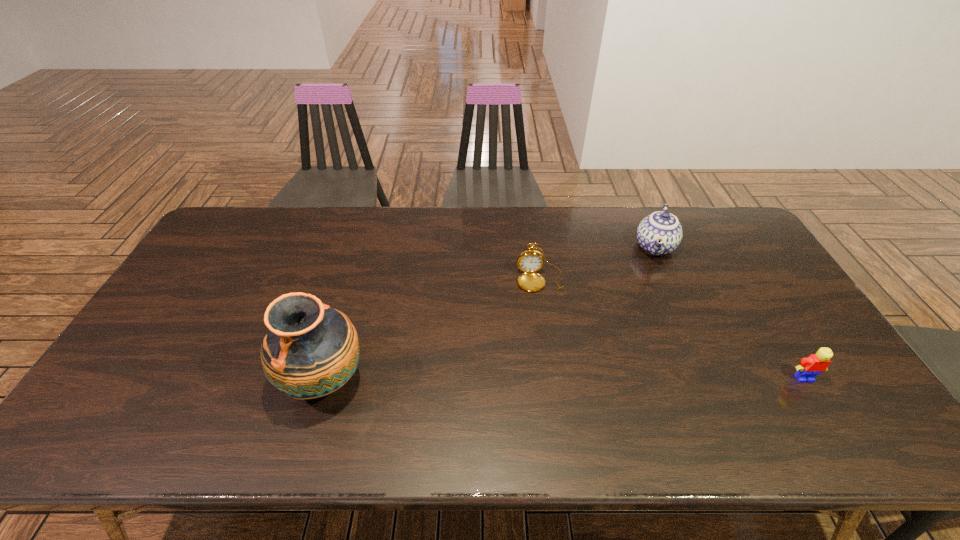
Where is `vacant region at the left edge`? Image resolution: width=960 pixels, height=540 pixels. vacant region at the left edge is located at coordinates (199, 340).

You are a GUI agent. You are given a task and a screenshot of the screen. Output one action in this format:
    pyautogui.click(x=<x>, y=<y>)
    Task: Click on the vacant space at the right edge of the desktop
    
    Given the screenshot: What is the action you would take?
    pyautogui.click(x=776, y=367)

In the image, there is a desktop. Identify the location of vacant space at the far left corner. (249, 242).

Where is `free space between the chinaware and the tallest object`? The height and width of the screenshot is (540, 960). free space between the chinaware and the tallest object is located at coordinates (490, 313).

At what (x,y) coordinates should I click in order to perform the action: click on free space between the chinaware and the Lego. Please return your answer as a coordinate pair (x, y). This screenshot has height=540, width=960. Looking at the image, I should click on (730, 312).

The image size is (960, 540). Find the location of `free space between the tallest object and the pocket watch`. free space between the tallest object and the pocket watch is located at coordinates (432, 330).

Locate an element on the screen. The width and height of the screenshot is (960, 540). vacant area between the third object from right to left and the rightmost object is located at coordinates (672, 329).

In order to click on vacant space in between the rightmost object and the chinaware in this screenshot , I will do `click(730, 312)`.

The image size is (960, 540). In order to click on vacant point located between the leftmost object and the rightmost object in this screenshot , I will do `click(564, 379)`.

This screenshot has width=960, height=540. I want to click on vacant space that is in between the pottery and the rightmost object, so click(x=564, y=379).